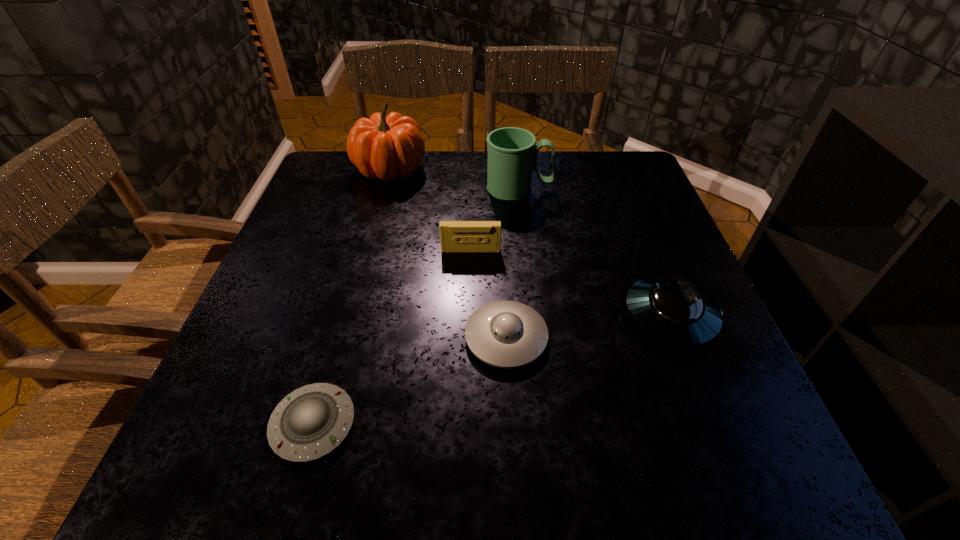
Locate an element on the screen. free space located 0.270m on the front of the tallest object is located at coordinates (367, 258).

Where is `vacant region located on the side of the fifth shortest object with the handle`? The image size is (960, 540). vacant region located on the side of the fifth shortest object with the handle is located at coordinates (640, 190).

Find the location of a particular element. The width and height of the screenshot is (960, 540). blank area located 0.370m at the front of the videotape with spools is located at coordinates tap(468, 404).

Identify the location of vacant space located 0.380m on the back of the fourth tallest object. The height and width of the screenshot is (540, 960). (617, 183).

Find the location of a particular element. The height and width of the screenshot is (540, 960). blank space located 0.230m on the back of the second tallest saucer is located at coordinates (501, 233).

Find the location of `free location located on the back of the shortest saucer`. free location located on the back of the shortest saucer is located at coordinates (336, 345).

Where is `pumpkin that is at the far edge`? The width and height of the screenshot is (960, 540). pumpkin that is at the far edge is located at coordinates (382, 147).

You are a GUI agent. You are given a task and a screenshot of the screen. Output one action in this format:
    pyautogui.click(x=<x>, y=<y>)
    Task: Click on the mug at the far edge
    
    Given the screenshot: What is the action you would take?
    pyautogui.click(x=512, y=154)

Identify the location of object positioned at the near edge. This screenshot has width=960, height=540. (310, 422).

In order to click on pumpkin located in the left edge section of the desktop in this screenshot , I will do `click(382, 147)`.